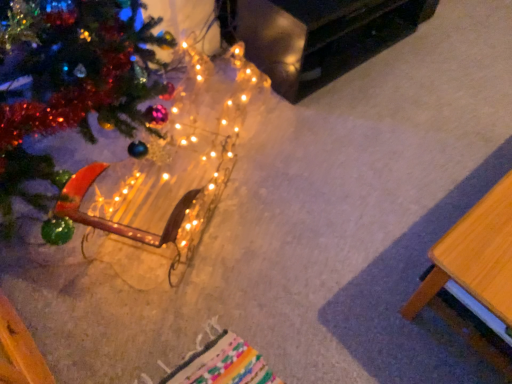
Image resolution: width=512 pixels, height=384 pixels. Identify the location of free space to the back side of wooden table at lower right, marked as the 1th table in a front-to-back arrangement. (420, 145).